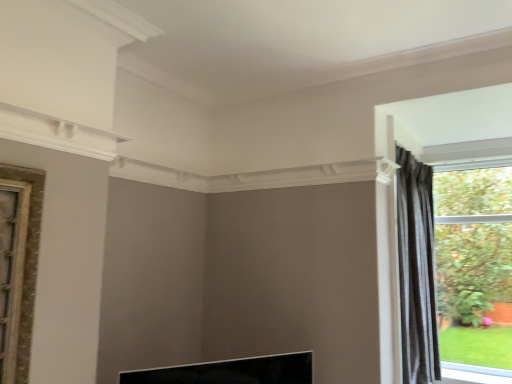
This screenshot has height=384, width=512. What do you see at coordinates (416, 270) in the screenshot? I see `dark gray striped curtain at right` at bounding box center [416, 270].

I want to click on dark gray striped curtain at right, so click(x=416, y=270).

What is the approximate height of dark gray striped curtain at right?

5.74 feet.

The width and height of the screenshot is (512, 384). Identify the location of dark gray striped curtain at right. (416, 270).